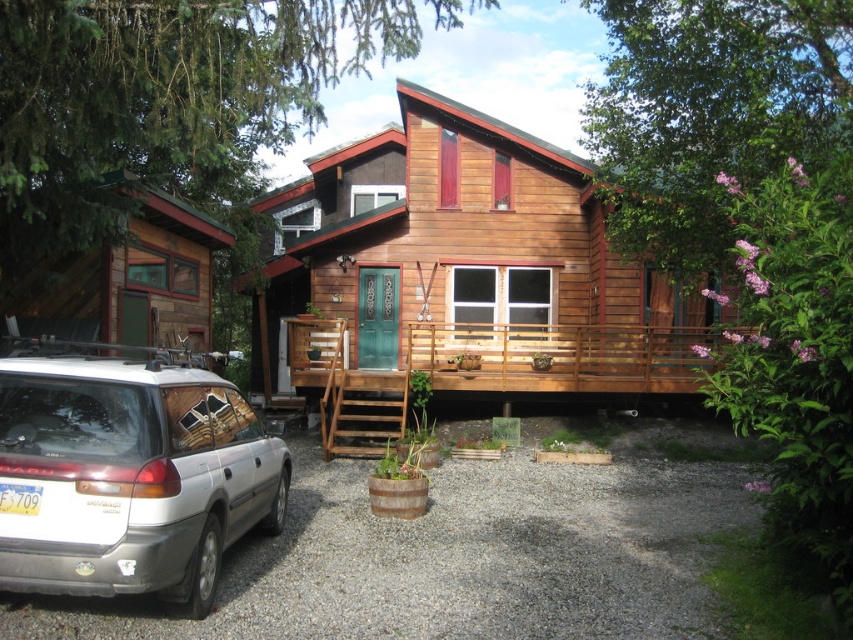
Can you confirm if wooden cabin at center is positioned below silver metallic car at lower left?

No, wooden cabin at center is not below silver metallic car at lower left.

Does wooden cabin at center have a greater height compared to silver metallic car at lower left?

Yes.

Which is in front, point (643, 282) or point (49, 449)?

Point (49, 449) is in front.

Locate an element on the screen. The height and width of the screenshot is (640, 853). wooden cabin at center is located at coordinates (461, 259).

In the scene shown: Can you confirm if silver metallic car at lower left is smaller than wooden cabin at left?

Yes, silver metallic car at lower left is smaller than wooden cabin at left.

Who is more distant from viewer, (90, 458) or (215, 228)?

Point (215, 228)

Does point (138, 477) lie in front of point (91, 276)?

Yes.

You are a GUI agent. You are given a task and a screenshot of the screen. Output one action in this format:
    pyautogui.click(x=<x>, y=<y>)
    Task: Click on the silver metallic car at lower left
    The image size is (853, 640).
    Given the screenshot: What is the action you would take?
    pyautogui.click(x=129, y=477)

Which of these two, gray gravel driveway at lower left or wooden cabin at left, stands shorter?

gray gravel driveway at lower left is shorter.

Is gray gravel driveway at lower left below wooden cabin at left?

Yes, gray gravel driveway at lower left is below wooden cabin at left.

You are a GUI agent. You are given a task and a screenshot of the screen. Output one action in this format:
    pyautogui.click(x=<x>, y=<y>)
    Task: Click on the gray gravel driveway at lower left
    This screenshot has height=640, width=853.
    Given the screenshot: What is the action you would take?
    pyautogui.click(x=467, y=550)